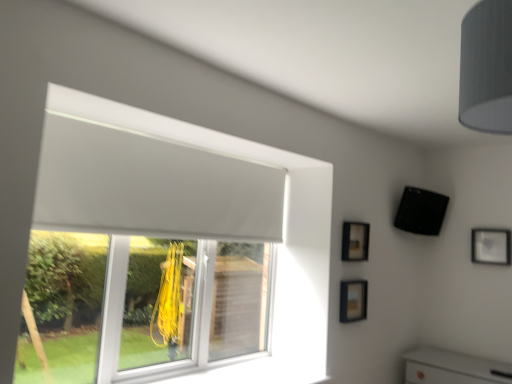
Describe the element at coordinates (355, 241) in the screenshot. This screenshot has width=512, height=384. I see `matte black picture frame at upper right, which ranks as the 2th picture frame in back-to-front order` at that location.

Measure the distance between matte black picture frame at upper right, positioned as the third picture frame in left-to-right order, and camera.

matte black picture frame at upper right, positioned as the third picture frame in left-to-right order, is 3.04 meters away from camera.

Identify the location of matte black picture frame at lower center, marked as the third picture frame in a back-to-front arrangement. (353, 300).

In order to face matte black picture frame at lower center, which ranks as the 1th picture frame in front-to-back order, should I rotate leftwards or rightwards?

Turn right approximately 13.326 degrees to face it.

This screenshot has width=512, height=384. I want to click on matte black picture frame at upper right, the second picture frame viewed from the front, so click(355, 241).

Does white matte window at upper left touch gray fabric lampshade at upper right?

No, white matte window at upper left is not with gray fabric lampshade at upper right.

Considering the sizes of white matte window at upper left and gray fabric lampshade at upper right in the image, is white matte window at upper left wider or thinner than gray fabric lampshade at upper right?

white matte window at upper left is thinner than gray fabric lampshade at upper right.

Is white matte window at upper left taller or shorter than gray fabric lampshade at upper right?

In the image, white matte window at upper left appears to be taller than gray fabric lampshade at upper right.

Is white matte window at upper left not within gray fabric lampshade at upper right?

That's correct, white matte window at upper left is outside of gray fabric lampshade at upper right.

Could you tell me if matte black picture frame at upper right, positioned as the third picture frame in left-to-right order, is turned towards white matte window screen at upper left?

No, matte black picture frame at upper right, positioned as the third picture frame in left-to-right order, does not turn towards white matte window screen at upper left.

Is point (499, 245) positioned behind point (157, 177)?

That is True.

From a real-world perspective, is matte black picture frame at upper right, positioned as the third picture frame in left-to-right order, above or below white matte window screen at upper left?

In terms of real-world spatial position, matte black picture frame at upper right, positioned as the third picture frame in left-to-right order, is below white matte window screen at upper left.

Can you confirm if black matte speaker at upper right is smaller than white matte window screen at upper left?

Indeed, black matte speaker at upper right has a smaller size compared to white matte window screen at upper left.

Can you confirm if black matte speaker at upper right is wider than white matte window screen at upper left?

No.

What are the coordinates of `speaker that appears on the right of white matte window screen at upper left` in the screenshot? It's located at (421, 211).

In the image, is black matte speaker at upper right on the left side or the right side of white matte window screen at upper left?

black matte speaker at upper right is positioned on white matte window screen at upper left's right side.

Between point (155, 121) and point (108, 179), which one is positioned behind?

The point (155, 121) is more distant.

Is white matte window at upper left looking in the opposite direction of white matte window screen at upper left?

Correct, white matte window at upper left is looking away from white matte window screen at upper left.

Considering the relative positions of white matte window at upper left and white matte window screen at upper left in the image provided, is white matte window at upper left to the right of white matte window screen at upper left from the viewer's perspective?

No, white matte window at upper left is not to the right of white matte window screen at upper left.

Which of these two, white matte window at upper left or white matte window screen at upper left, is smaller?

white matte window screen at upper left.

Which object is further away from the camera, white matte window screen at upper left or white matte window at upper left?

white matte window screen at upper left.

From a real-world perspective, relative to white matte window at upper left, is white matte window screen at upper left vertically above or below?

From a real-world perspective, white matte window screen at upper left is physically above white matte window at upper left.

Can you confirm if white matte window screen at upper left is taller than white matte window at upper left?

Incorrect, the height of white matte window screen at upper left is not larger of that of white matte window at upper left.

Are white matte window screen at upper left and white matte window at upper left far apart?

No, white matte window screen at upper left is not far away from white matte window at upper left.

How different are the orientations of matte black picture frame at upper right, positioned as the 1th picture frame in right-to-left order, and matte black picture frame at upper right, placed as the 2th picture frame when sorted from left to right, in degrees?

There is a 90.7-degree angle between the facing directions of matte black picture frame at upper right, positioned as the 1th picture frame in right-to-left order, and matte black picture frame at upper right, placed as the 2th picture frame when sorted from left to right.

Would you say matte black picture frame at upper right, positioned as the third picture frame in front-to-back order, is inside or outside matte black picture frame at upper right, which ranks as the 2th picture frame in back-to-front order?

matte black picture frame at upper right, positioned as the third picture frame in front-to-back order, lies outside matte black picture frame at upper right, which ranks as the 2th picture frame in back-to-front order.

Does point (483, 235) come closer to viewer compared to point (362, 229)?

That is False.

Can you confirm if matte black picture frame at upper right, positioned as the 1th picture frame in back-to-front order, is smaller than matte black picture frame at upper right, which ranks as the 2th picture frame in back-to-front order?

Yes.

Between white matte window at upper left and matte black picture frame at upper right, which ranks as the 2th picture frame in back-to-front order, which one is positioned in front?

white matte window at upper left is more forward.

Considering the relative positions of white matte window at upper left and matte black picture frame at upper right, which ranks as the 2th picture frame in back-to-front order, in the image provided, is white matte window at upper left to the right of matte black picture frame at upper right, which ranks as the 2th picture frame in back-to-front order, from the viewer's perspective?

No.

Could you tell me if white matte window at upper left is facing matte black picture frame at upper right, which ranks as the 2th picture frame in back-to-front order?

No, white matte window at upper left is not turned towards matte black picture frame at upper right, which ranks as the 2th picture frame in back-to-front order.

Locate an element on the screen. The width and height of the screenshot is (512, 384). window below the gray fabric lampshade at upper right (from the image's perspective) is located at coordinates tap(170, 251).

In order to click on window screen above the matte black picture frame at upper right, positioned as the 1th picture frame in right-to-left order (from the image's perspective) in this screenshot , I will do `click(151, 187)`.

Looking at the image, which one is located further to matte black picture frame at upper right, positioned as the 1th picture frame in back-to-front order, gray fabric lampshade at upper right or matte black picture frame at lower center, which appears as the 1th picture frame when viewed from the left?

gray fabric lampshade at upper right is further to matte black picture frame at upper right, positioned as the 1th picture frame in back-to-front order.

Which object lies nearer to the anchor point white matte window screen at upper left, matte black picture frame at upper right, positioned as the 1th picture frame in back-to-front order, or matte black picture frame at upper right, placed as the 2th picture frame when sorted from left to right?

matte black picture frame at upper right, placed as the 2th picture frame when sorted from left to right, is closer to white matte window screen at upper left.

Based on their spatial positions, is matte black picture frame at lower center, which ranks as the 1th picture frame in front-to-back order, or black matte speaker at upper right closer to gray fabric lampshade at upper right?

matte black picture frame at lower center, which ranks as the 1th picture frame in front-to-back order, lies closer to gray fabric lampshade at upper right than the other object.

Based on their spatial positions, is matte black picture frame at lower center, which appears as the 1th picture frame when viewed from the left, or matte black picture frame at upper right, placed as the 2th picture frame when sorted from left to right, closer to matte black picture frame at upper right, positioned as the third picture frame in front-to-back order?

matte black picture frame at upper right, placed as the 2th picture frame when sorted from left to right, lies closer to matte black picture frame at upper right, positioned as the third picture frame in front-to-back order, than the other object.

Which object lies nearer to the anchor point matte black picture frame at lower center, which ranks as the 1th picture frame in front-to-back order, black matte speaker at upper right or white matte window at upper left?

The object closer to matte black picture frame at lower center, which ranks as the 1th picture frame in front-to-back order, is black matte speaker at upper right.

Looking at this image, when comparing their distances from matte black picture frame at upper right, positioned as the 1th picture frame in back-to-front order, does gray fabric lampshade at upper right or white matte window at upper left seem further?

Based on the image, gray fabric lampshade at upper right appears to be further to matte black picture frame at upper right, positioned as the 1th picture frame in back-to-front order.

Looking at the image, which one is located further to matte black picture frame at lower center, which ranks as the 1th picture frame in front-to-back order, matte black picture frame at upper right, which ranks as the 2th picture frame in back-to-front order, or white matte window screen at upper left?

white matte window screen at upper left lies further to matte black picture frame at lower center, which ranks as the 1th picture frame in front-to-back order, than the other object.

Based on the photo, when comparing their distances from matte black picture frame at upper right, the second picture frame viewed from the front, does white matte window at upper left or matte black picture frame at lower center, which ranks as the third picture frame in right-to-left order, seem further?

white matte window at upper left is positioned further to the anchor matte black picture frame at upper right, the second picture frame viewed from the front.

Where is `picture frame positioned between gray fabric lampshade at upper right and matte black picture frame at upper right, which ranks as the 2th picture frame in back-to-front order, from near to far`? The width and height of the screenshot is (512, 384). picture frame positioned between gray fabric lampshade at upper right and matte black picture frame at upper right, which ranks as the 2th picture frame in back-to-front order, from near to far is located at coordinates (353, 300).

The height and width of the screenshot is (384, 512). Identify the location of window between gray fabric lampshade at upper right and black matte speaker at upper right in the front-back direction. (170, 251).

Locate an element on the screen. window screen between white matte window at upper left and matte black picture frame at upper right, placed as the 2th picture frame when sorted from left to right, in the horizontal direction is located at coordinates (151, 187).

Find the location of a particular element. This screenshot has height=384, width=512. window screen located between white matte window at upper left and matte black picture frame at upper right, positioned as the third picture frame in left-to-right order, in the left-right direction is located at coordinates (151, 187).